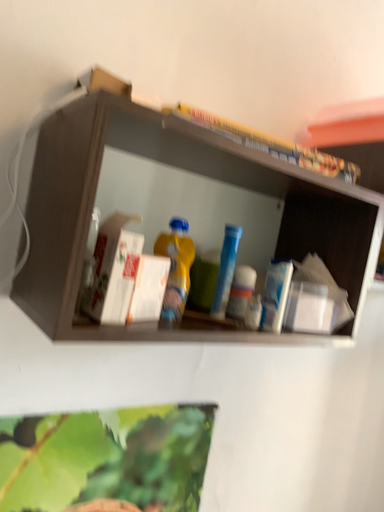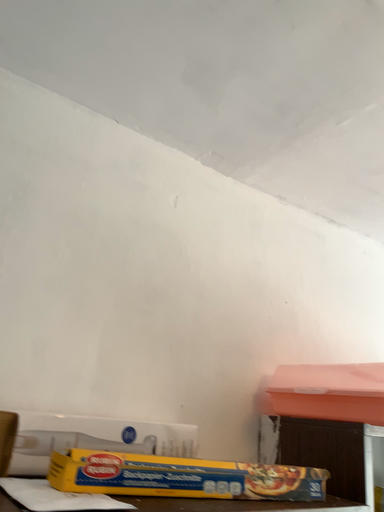
Question: Which way did the camera rotate in the video?

Choices:
 (A) rotated downward
 (B) rotated upward

Answer: (B)